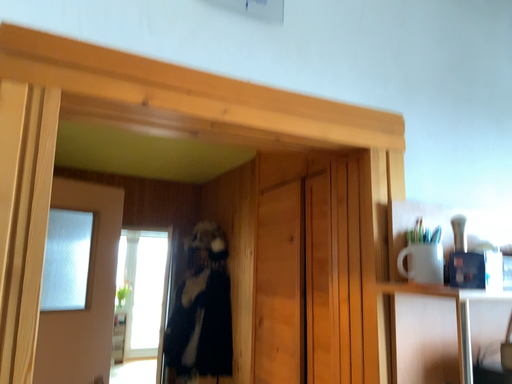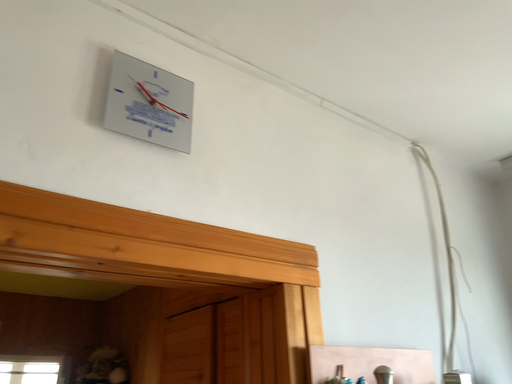
Question: Which way did the camera rotate in the video?

Choices:
 (A) rotated right
 (B) rotated left

Answer: (A)